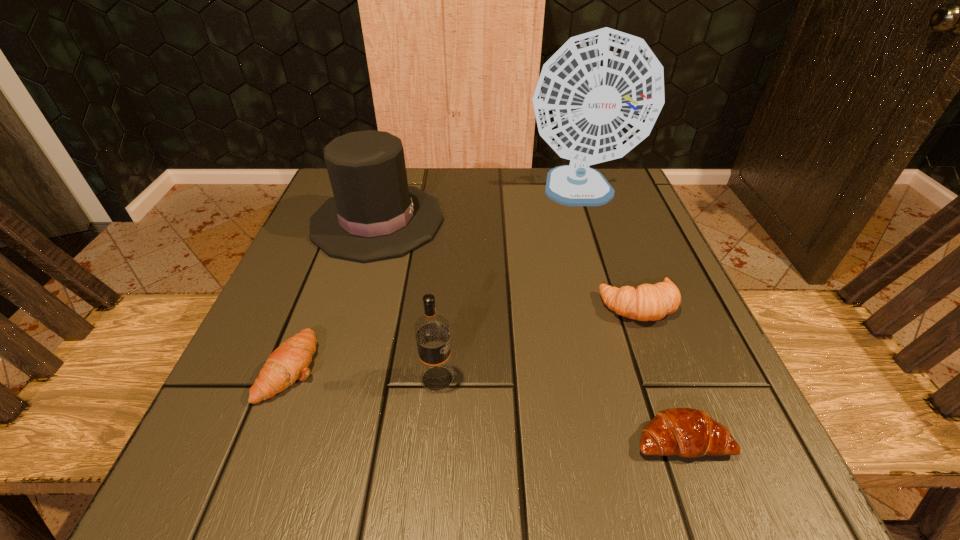
This screenshot has width=960, height=540. What are the coordinates of `the tallest object` in the screenshot? It's located at (599, 95).

Where is `dress hat`? dress hat is located at coordinates (374, 214).

You are a GUI agent. You are given a task and a screenshot of the screen. Output one action in this format:
    pyautogui.click(x=<x>, y=<y>)
    Task: Click on the vodka
    The width and height of the screenshot is (960, 540).
    Given the screenshot: What is the action you would take?
    pyautogui.click(x=431, y=329)

Identify the location of the fourth tallest object. (647, 302).

I want to click on the fourth nearest object, so click(x=647, y=302).

Find the location of a particular element. The height and width of the screenshot is (540, 960). the nearest crescent roll is located at coordinates point(685,432).

The image size is (960, 540). I want to click on the leftmost crescent roll, so click(289, 362).

At what (x,y) coordinates should I click in order to perform the action: click on vacant space positioned 0.180m on the grille of the fan. Please return your answer as a coordinate pair (x, y). The width and height of the screenshot is (960, 540). Looking at the image, I should click on (607, 280).

Where is `free space located 0.120m on the front of the dress hat with the decoration`? This screenshot has width=960, height=540. free space located 0.120m on the front of the dress hat with the decoration is located at coordinates (499, 221).

Where is `vacant point located 0.320m on the label of the vodka`? vacant point located 0.320m on the label of the vodka is located at coordinates (670, 379).